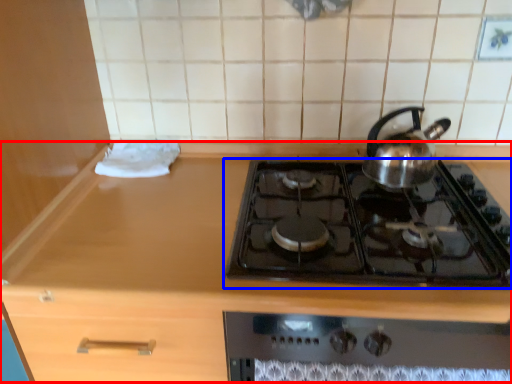
Question: Which point is further to the camera, counter (highlighted by a red box) or gas stove (highlighted by a blue box)?

Choices:
 (A) counter
 (B) gas stove

Answer: (B)